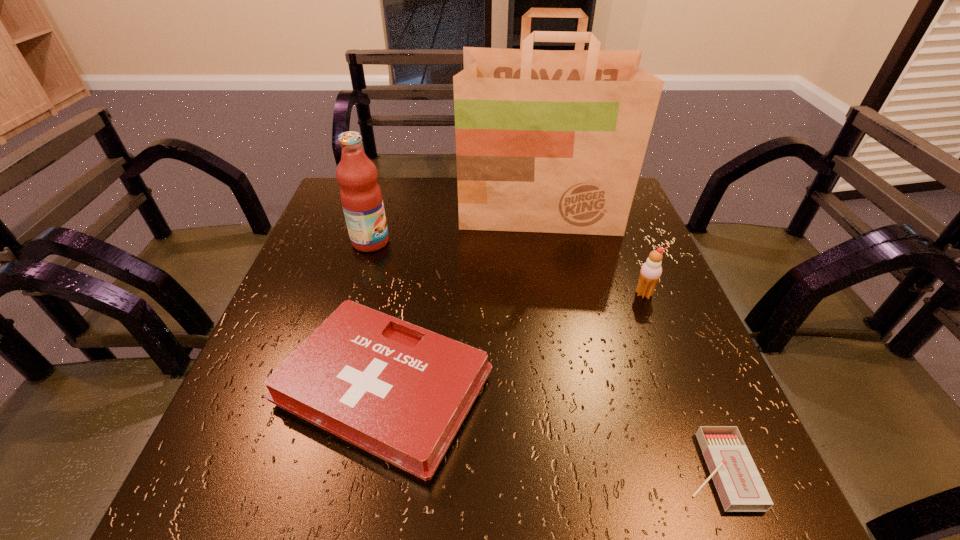
The height and width of the screenshot is (540, 960). In order to click on matchbox located in the right edge section of the desktop in this screenshot , I will do `click(740, 487)`.

The width and height of the screenshot is (960, 540). I want to click on object positioned at the near left corner, so click(401, 392).

Where is `object that is at the far right corner`? Image resolution: width=960 pixels, height=540 pixels. object that is at the far right corner is located at coordinates (547, 141).

Where is `object present at the near right corner`? The height and width of the screenshot is (540, 960). object present at the near right corner is located at coordinates (740, 487).

Locate an element on the screen. vacant space at the far edge is located at coordinates (452, 211).

Identify the location of free region at the near edge. (408, 482).

Image resolution: width=960 pixels, height=540 pixels. Identify the location of vacant space at the left edge of the desktop. click(266, 404).

At what (x,y) coordinates should I click in order to perform the action: click on vacant region at the right edge of the desktop. Please return your answer as a coordinate pair (x, y). The height and width of the screenshot is (540, 960). Looking at the image, I should click on (623, 255).

You are a GUI agent. You are given a task and a screenshot of the screen. Output one action in this format:
    pyautogui.click(x=<x>, y=<y>)
    Task: Click on the free point between the third farthest object and the second tallest object
    
    Given the screenshot: What is the action you would take?
    pyautogui.click(x=507, y=268)

Where is `free point between the fruit juice and the third tallest object`? This screenshot has height=540, width=960. free point between the fruit juice and the third tallest object is located at coordinates (507, 268).